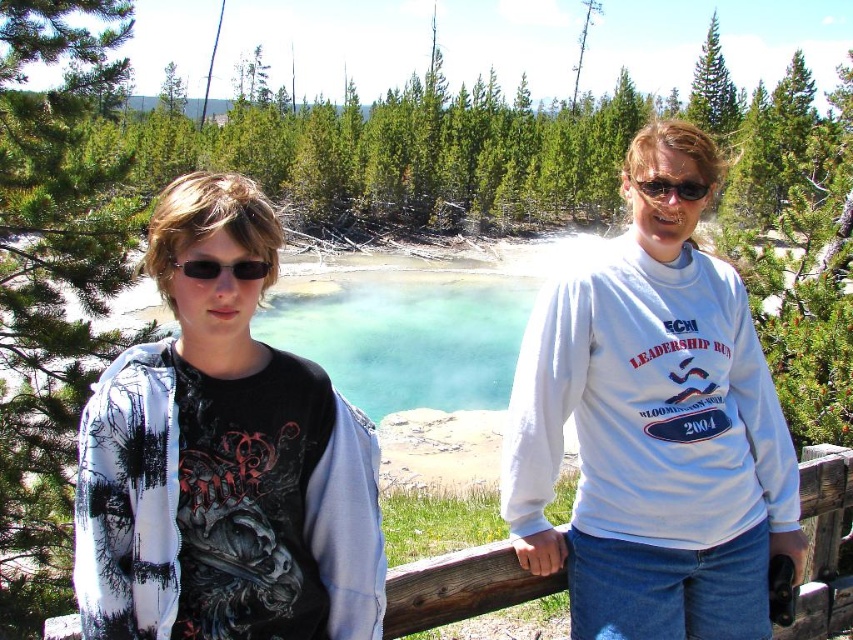
Question: Which is nearer to the matte black hoodie at left?

Choices:
 (A) black plastic sunglasses at left
 (B) black plastic sunglasses at upper center
 (C) white cotton shirt at center

Answer: (A)

Question: Is white cotton shirt at center bigger than black plastic sunglasses at left?

Choices:
 (A) yes
 (B) no

Answer: (A)

Question: Is black plastic sunglasses at left thinner than black plastic sunglasses at upper center?

Choices:
 (A) yes
 (B) no

Answer: (A)

Question: Can you confirm if matte black hoodie at left is bigger than black plastic sunglasses at upper center?

Choices:
 (A) no
 (B) yes

Answer: (B)

Question: Which point appears closest to the camera in this image?

Choices:
 (A) (711, 262)
 (B) (260, 260)
 (C) (202, 179)
 (D) (677, 182)

Answer: (B)

Question: Which point appears farthest from the camera in this image?

Choices:
 (A) (639, 186)
 (B) (659, 230)

Answer: (B)